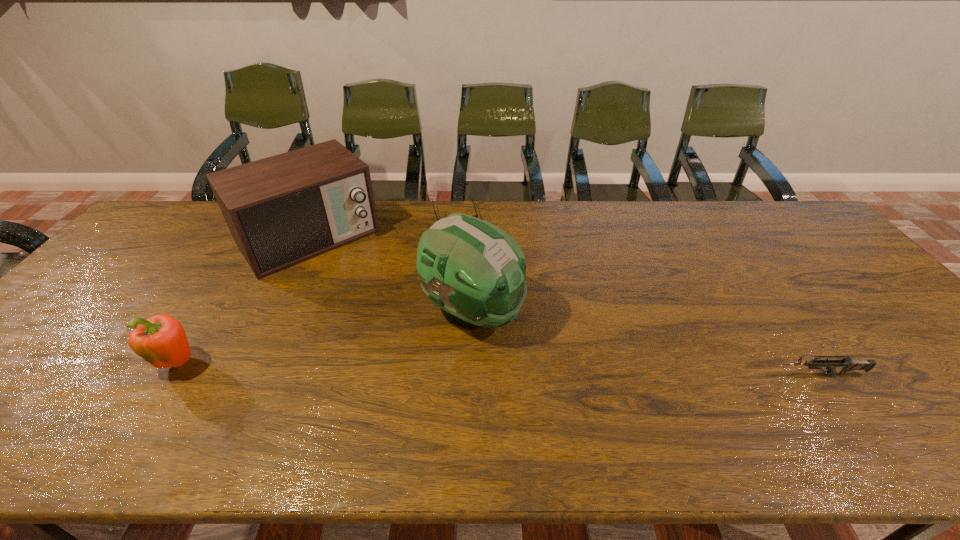
Where is `vacant space located on the visor of the football helmet`? vacant space located on the visor of the football helmet is located at coordinates (650, 409).

Where is `free space located 0.050m on the visor of the football helmet`? free space located 0.050m on the visor of the football helmet is located at coordinates (532, 344).

The image size is (960, 540). What are the coordinates of `vacant space situated 0.170m on the visor of the football helmet` in the screenshot? It's located at (575, 368).

Find the location of a particular element. This screenshot has width=960, height=540. free region located 0.050m on the front-facing side of the shortest object is located at coordinates (462, 238).

This screenshot has width=960, height=540. What are the coordinates of `blank space located 0.090m on the front-facing side of the shortest object` in the screenshot? It's located at (464, 245).

Find the location of a particular element. The height and width of the screenshot is (540, 960). vacant space situated 0.100m on the front-facing side of the shortest object is located at coordinates (465, 247).

You are a GUI agent. You are given a task and a screenshot of the screen. Output one action in this format:
    pyautogui.click(x=<x>, y=<y>)
    Task: Click on the free space located 0.350m on the front-facing side of the fourth shortest object
    
    Given the screenshot: What is the action you would take?
    pyautogui.click(x=399, y=341)

This screenshot has height=540, width=960. Find the location of `vacant space located on the front-facing side of the fourth shortest object`. vacant space located on the front-facing side of the fourth shortest object is located at coordinates (368, 303).

Where is `vacant region located 0.170m on the front-facing side of the fourth shortest object`? The image size is (960, 540). vacant region located 0.170m on the front-facing side of the fourth shortest object is located at coordinates (366, 301).

This screenshot has width=960, height=540. I want to click on sunglasses that is positioned at the far edge, so click(x=476, y=215).